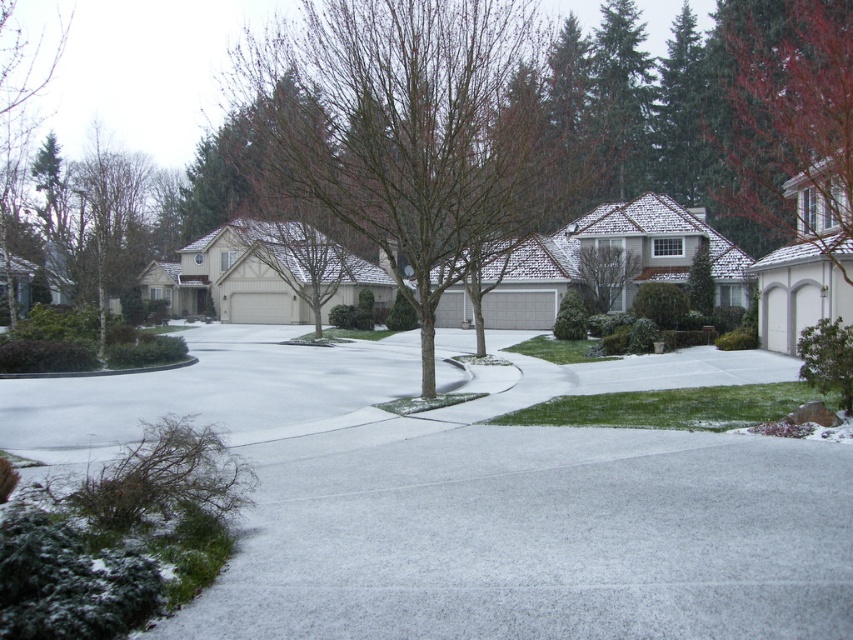
Does white textured pavement at lower center come behind bare branches at center?

No, it is not.

Does point (840, 625) come in front of point (550, 209)?

That is True.

Locate an element on the screen. white textured pavement at lower center is located at coordinates (543, 540).

Is white textured pavement at lower center in front of red matte tree at upper right?

Yes, it is.

Between point (821, 541) and point (724, 80), which one is positioned behind?

Positioned behind is point (724, 80).

This screenshot has height=640, width=853. I want to click on white textured pavement at lower center, so click(x=543, y=540).

Is bare branches at center positioned at the back of red matte tree at upper right?

Yes, bare branches at center is behind red matte tree at upper right.

Between point (500, 131) and point (838, 193), which one is positioned behind?

The point (838, 193) is more distant.

The image size is (853, 640). In order to click on bare branches at center in this screenshot , I will do `click(409, 132)`.